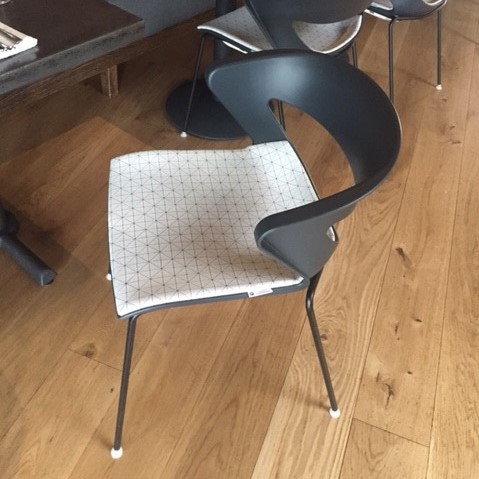
This screenshot has height=479, width=479. In order to click on desk surface in this screenshot , I will do `click(57, 22)`.